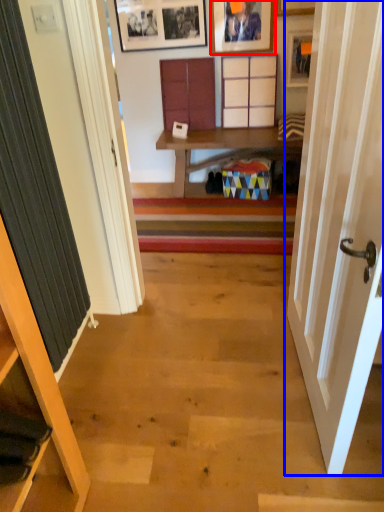
Question: Which point is further to the camera, picture frame (highlighted by a red box) or door (highlighted by a blue box)?

Choices:
 (A) picture frame
 (B) door

Answer: (A)